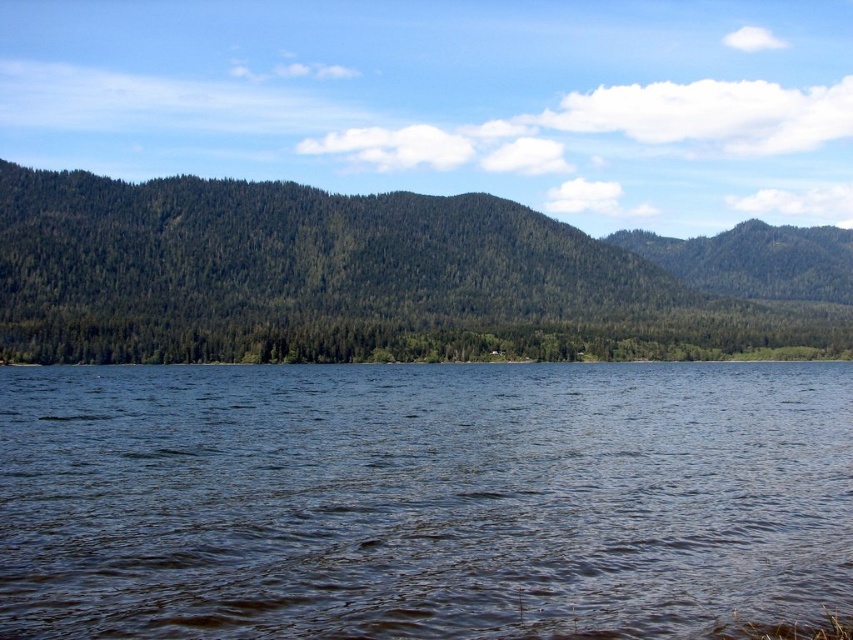
Consider the image. You are standing at the edge of the dark blue water at center and want to throw a small pebble into it. If the pebble can travel 20 meters, will it reach the water?

The dark blue water at center is 22.05 meters away from the viewer. Since the pebble can only travel 20 meters, it will not reach the water.

From the picture: You are standing at the point closest to the camera in the image. Which point, point [708,472] or point [596,355], are you currently at?

You are at point [708,472] because it is closer to the camera than point [596,355].

You are standing at the center of the image and want to locate the dark blue water at center. According to the coordinates provided, in which direction should you move to find it?

The dark blue water at center is located at coordinates point [422,499]. Since you are already at the center, you would need to move slightly to the right and slightly downward to reach it.